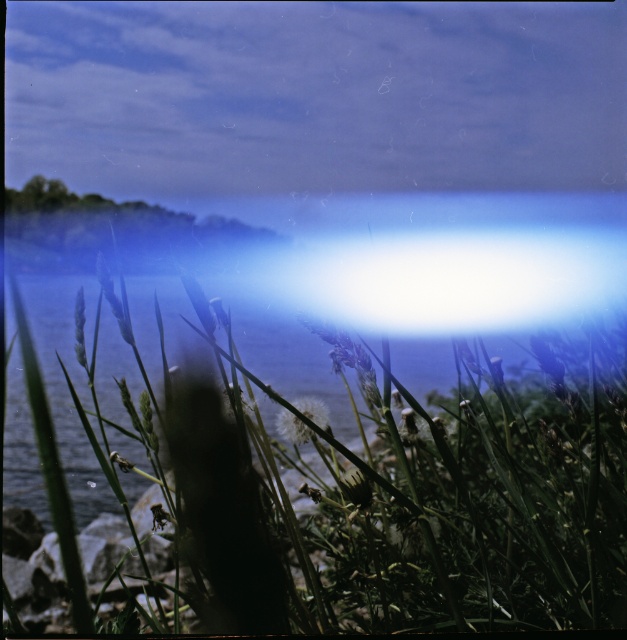
You are standing at the lakeside and looking at two points in the image. The first point is located at coordinates point (477,396) and the second point is at point (322,422). Based on the scene description, which of these two points is closer to you?

Point (477,396) is closer to the viewer than point (322,422).

You are standing at the point with coordinates (356, 493) in the image. What is the object located at that point?

The point at coordinates (356, 493) corresponds to green grass at lower left.

You are standing at the center of the image and want to walk towards the green grass at lower left. Which direction should you face to head directly towards it?

To head directly towards the green grass at lower left, you should face towards the lower left direction since it is located at point (x=356, y=493).